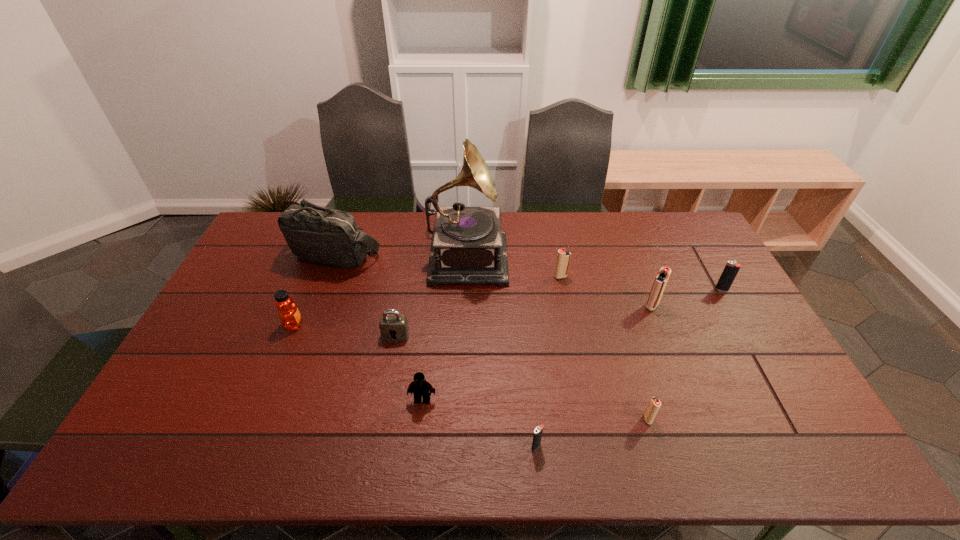
Identify the location of unoccupied area between the second object from right to left and the padlock. (524, 321).

The image size is (960, 540). In order to click on empty space between the ninth shortest object and the Lego in this screenshot , I will do `click(379, 328)`.

Locate an element on the screen. Image resolution: width=960 pixels, height=540 pixels. free space between the fourth farthest igniter and the honey is located at coordinates (471, 372).

Identify the location of vacant space in between the golden record player and the rightmost igniter. This screenshot has height=540, width=960. (594, 272).

Identify the location of free spot between the leftmost igniter and the second farthest red igniter. The width and height of the screenshot is (960, 540). (594, 376).

At what (x,y) coordinates should I click in order to perform the action: click on blank region between the Lego and the second nearest igniter. Please return your answer as a coordinate pair (x, y). This screenshot has width=960, height=540. Looking at the image, I should click on (535, 409).

The width and height of the screenshot is (960, 540). In order to click on free space between the third object from left to right and the honey in this screenshot , I will do `click(345, 330)`.

Image resolution: width=960 pixels, height=540 pixels. What are the coordinates of `object that stands as the fourth closest to the farthest igniter` in the screenshot? It's located at (393, 326).

The width and height of the screenshot is (960, 540). In order to click on object that is the sixth closest one to the fourth object from right to left in this screenshot , I will do `click(421, 387)`.

The height and width of the screenshot is (540, 960). I want to click on the second closest igniter to the shoulder bag, so click(538, 431).